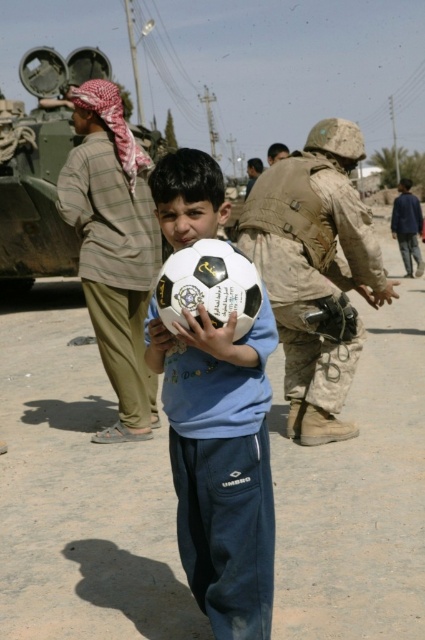
Question: Can you confirm if camouflage painted tank at upper left is positioned above blue fabric jacket at upper right?

Choices:
 (A) no
 (B) yes

Answer: (B)

Question: Which object appears closest to the camera in this image?

Choices:
 (A) blue fabric jacket at upper right
 (B) white matte soccer ball at center

Answer: (B)

Question: Is khaki cotton pants at left closer to camera compared to camouflage fabric helmet at center?

Choices:
 (A) yes
 (B) no

Answer: (A)

Question: Which point is farther to the camera?

Choices:
 (A) white matte soccer ball at center
 (B) camouflage painted tank at upper left
 (C) camouflage fabric helmet at center
 (D) camouflage uniform at center

Answer: (B)

Question: Can you confirm if khaki cotton pants at left is positioned to the right of camouflage fabric helmet at center?

Choices:
 (A) no
 (B) yes

Answer: (A)

Question: Which object is the farthest from the khaki cotton pants at left?

Choices:
 (A) camouflage fabric helmet at center
 (B) camouflage painted tank at upper left
 (C) blue fabric jacket at upper right

Answer: (C)